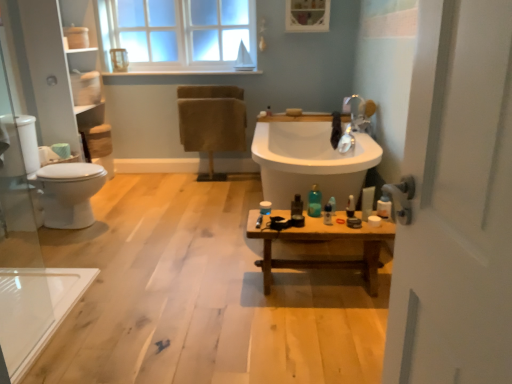
Find the location of a particular element. Image resolution: width=512 pixels, height=384 pixels. vacant area situated to the left side of wooden bench at center is located at coordinates (221, 284).